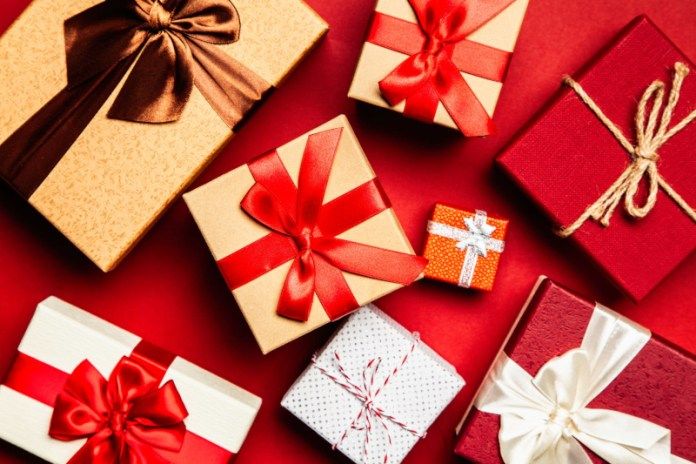
The height and width of the screenshot is (464, 696). Find the location of `wrapped box`. wrapped box is located at coordinates (106, 173), (79, 329), (264, 297), (386, 60), (454, 239), (377, 398), (551, 389), (663, 144).